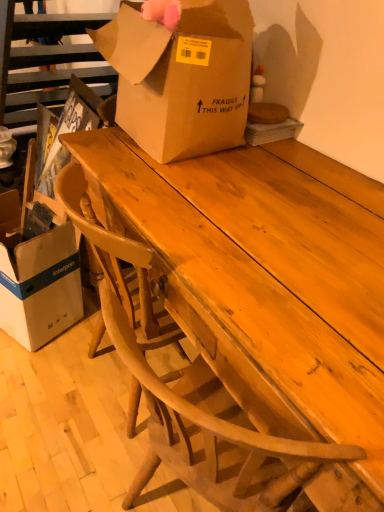
Question: Considering the relative sizes of brown cardboard box at center, placed as the first box when sorted from right to left, and wooden table at center in the image provided, is brown cardboard box at center, placed as the first box when sorted from right to left, smaller than wooden table at center?

Choices:
 (A) yes
 (B) no

Answer: (A)

Question: Is brown cardboard box at center, placed as the first box when sorted from right to left, closer to camera compared to wooden table at center?

Choices:
 (A) no
 (B) yes

Answer: (A)

Question: From the image's perspective, is brown cardboard box at center, placed as the first box when sorted from right to left, located beneath wooden table at center?

Choices:
 (A) yes
 (B) no

Answer: (B)

Question: Does brown cardboard box at center, the 2th box ordered from the bottom, lie behind wooden table at center?

Choices:
 (A) yes
 (B) no

Answer: (A)

Question: Can you confirm if brown cardboard box at center, which ranks as the 2th box in left-to-right order, is positioned to the right of wooden table at center?

Choices:
 (A) no
 (B) yes

Answer: (A)

Question: Is point (96, 45) positioned closer to the camera than point (1, 204)?

Choices:
 (A) farther
 (B) closer

Answer: (B)

Question: Considering their positions, is brown cardboard box at center, placed as the first box when sorted from right to left, located in front of or behind white cardboard box at lower left, which ranks as the second box in top-to-bottom order?

Choices:
 (A) front
 (B) behind

Answer: (A)

Question: From a real-world perspective, is brown cardboard box at center, the 2th box ordered from the bottom, physically located above or below white cardboard box at lower left, which ranks as the first box in bottom-to-top order?

Choices:
 (A) above
 (B) below

Answer: (A)

Question: Looking at their shapes, would you say brown cardboard box at center, the first box from the top, is wider or thinner than white cardboard box at lower left, which ranks as the first box in bottom-to-top order?

Choices:
 (A) thin
 (B) wide

Answer: (B)

Question: From a real-world perspective, is brown cardboard box at center, placed as the first box when sorted from right to left, above or below wooden table at center?

Choices:
 (A) below
 (B) above

Answer: (B)

Question: Considering their positions, is brown cardboard box at center, the first box from the top, located in front of or behind wooden table at center?

Choices:
 (A) behind
 (B) front

Answer: (A)

Question: Considering the positions of brown cardboard box at center, which ranks as the 2th box in left-to-right order, and wooden table at center in the image, is brown cardboard box at center, which ranks as the 2th box in left-to-right order, bigger or smaller than wooden table at center?

Choices:
 (A) big
 (B) small

Answer: (B)

Question: From their relative heights in the image, would you say brown cardboard box at center, the 2th box ordered from the bottom, is taller or shorter than wooden table at center?

Choices:
 (A) tall
 (B) short

Answer: (B)

Question: In terms of height, does white cardboard box at lower left, which ranks as the second box in top-to-bottom order, look taller or shorter compared to brown cardboard box at center, which ranks as the 2th box in left-to-right order?

Choices:
 (A) short
 (B) tall

Answer: (B)

Question: Is white cardboard box at lower left, which ranks as the first box in bottom-to-top order, bigger or smaller than brown cardboard box at center, the 2th box ordered from the bottom?

Choices:
 (A) small
 (B) big

Answer: (A)